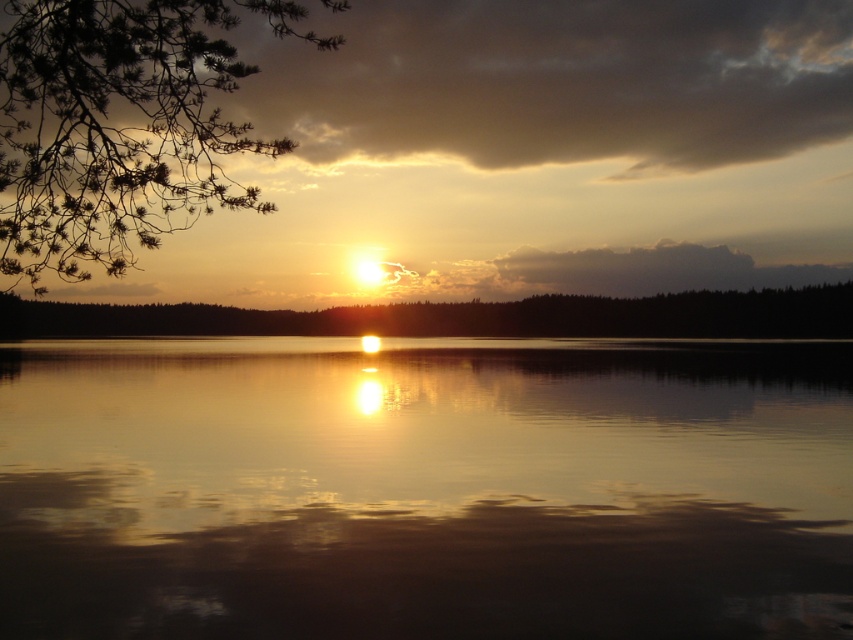
Which is more to the left, green needle-like branches at upper left or green matte tree at center?

green needle-like branches at upper left

What do you see at coordinates (119, 125) in the screenshot?
I see `green needle-like branches at upper left` at bounding box center [119, 125].

Locate an element on the screen. The width and height of the screenshot is (853, 640). green needle-like branches at upper left is located at coordinates (119, 125).

Is glistening reflective water at center thinner than green matte tree at center?

Yes, glistening reflective water at center is thinner than green matte tree at center.

Is glistening reflective water at center bigger than green matte tree at center?

No.

Which is in front, point (331, 614) or point (338, 332)?

Point (331, 614) is more forward.

The width and height of the screenshot is (853, 640). Find the location of `glistening reflective water at center`. glistening reflective water at center is located at coordinates (426, 490).

Between glistening reflective water at center and green needle-like branches at upper left, which one is positioned lower?

glistening reflective water at center

Can you confirm if glistening reflective water at center is taller than green needle-like branches at upper left?

No.

Identify the location of glistening reflective water at center. This screenshot has height=640, width=853. pos(426,490).